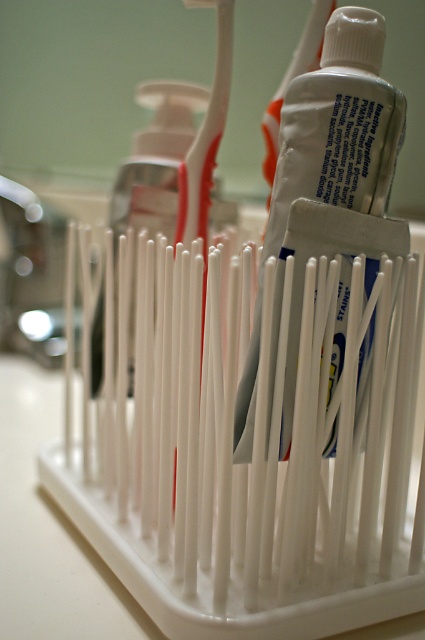
You are holding a smartphone camera and want to take a photo of the toothpaste tube in the white plastic toothbrush holder. The toothpaste tube is located at point (337, 33). What is the minimum distance you need to move your phone backward or forward to ensure the toothpaste tube is in focus?

The point (337, 33) is 26.34 inches away from the camera. To ensure the toothpaste tube is in focus, you need to move your phone so that the distance matches the focus point. Since the current distance is 26.34 inches, adjusting the focus to that distance or moving the phone to maintain that distance will keep the toothpaste tube sharp.

You have a small toy car that is 10 centimeters long. You want to place it between the white plastic toothbrush at center and the white plastic toothbrush at upper center. Will it fit?

The distance between the white plastic toothbrush at center and the white plastic toothbrush at upper center is 9.87 centimeters. Since the toy car is 10 centimeters long, it will not fit between them as the space is slightly smaller than the car.